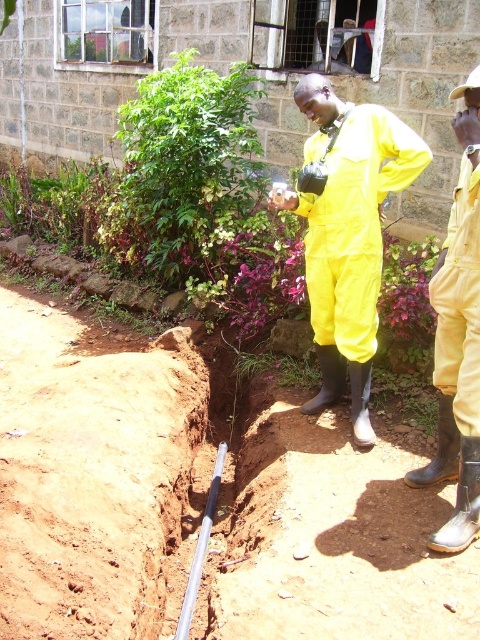
Question: Which object appears closest to the camera in this image?

Choices:
 (A) yellow rubber boots at lower right
 (B) yellow rubber suit at center

Answer: (A)

Question: Is yellow rubber suit at center positioned in front of yellow rubber boots at lower right?

Choices:
 (A) yes
 (B) no

Answer: (B)

Question: Can you confirm if yellow rubber suit at center is positioned to the right of yellow rubber boots at lower right?

Choices:
 (A) yes
 (B) no

Answer: (B)

Question: Does yellow rubber suit at center appear over yellow rubber boots at lower right?

Choices:
 (A) yes
 (B) no

Answer: (A)

Question: Which point is closer to the camera taking this photo?

Choices:
 (A) (349, 230)
 (B) (471, 76)

Answer: (B)